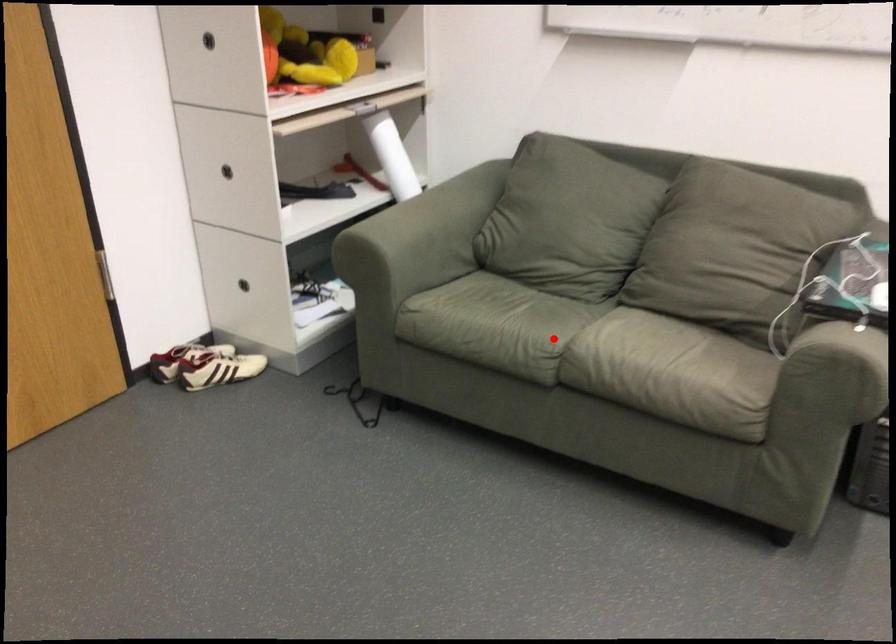
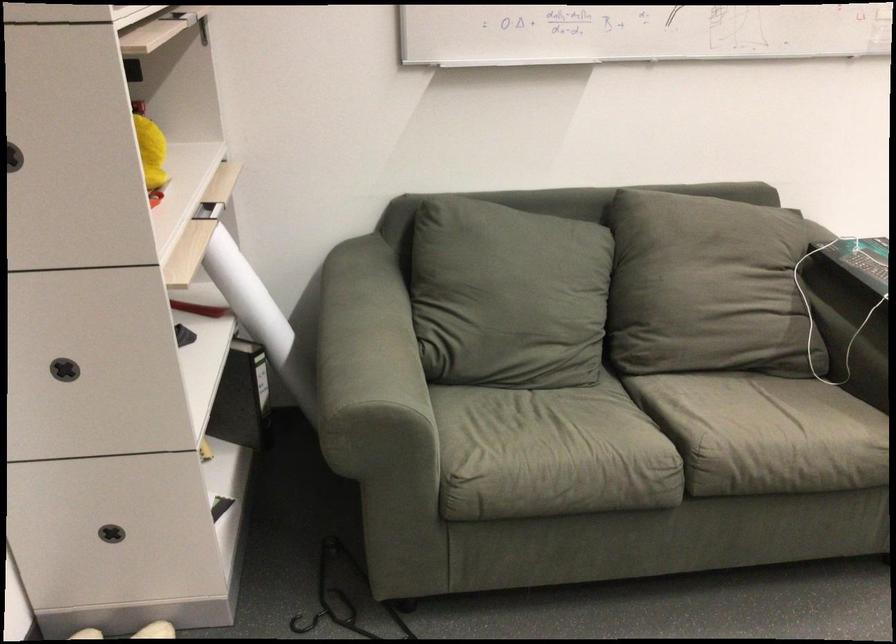
Question: I am providing you with two images of the same scene from different viewpoints. A red point is marked on the first image. Is the red point's position out of view in image 2?

Choices:
 (A) Yes
 (B) No

Answer: (B)